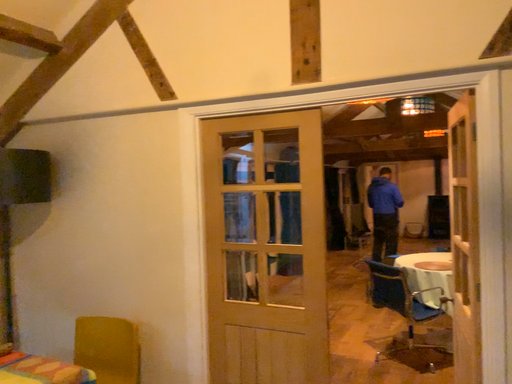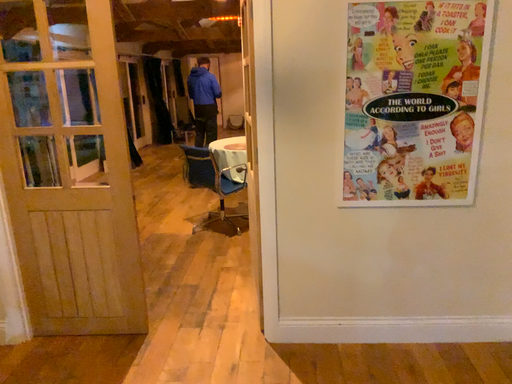
Question: Which way did the camera rotate in the video?

Choices:
 (A) rotated right
 (B) rotated left

Answer: (A)